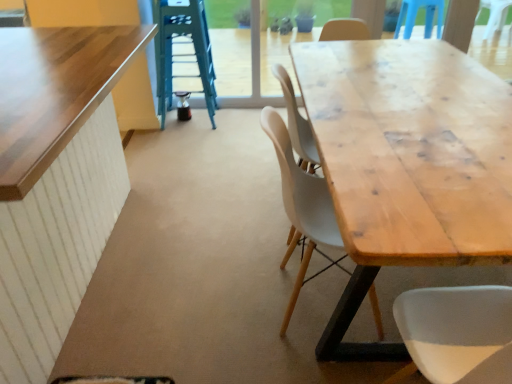
The height and width of the screenshot is (384, 512). What do you see at coordinates (183, 53) in the screenshot?
I see `green metallic ladder at upper center` at bounding box center [183, 53].

In order to face wooden table at left, the 1th table viewed from the left, should I rotate leftwards or rightwards?

To face it directly, rotate left by 30.659 degrees.

The image size is (512, 384). Describe the element at coordinates (301, 207) in the screenshot. I see `matte wood chair at center` at that location.

Find the location of a particular element. This screenshot has width=512, height=384. natural wood table at center, positioned as the first table in right-to-left order is located at coordinates pos(407,163).

What's the angular difference between green metallic ladder at upper center and wooden table at left, marked as the second table in a right-to-left arrangement,'s facing directions?

The facing directions of green metallic ladder at upper center and wooden table at left, marked as the second table in a right-to-left arrangement, are 176 degrees apart.

Is green metallic ladder at upper center facing towards wooden table at left, marked as the second table in a right-to-left arrangement?

Yes, green metallic ladder at upper center is oriented towards wooden table at left, marked as the second table in a right-to-left arrangement.

Consider the image. In terms of size, does green metallic ladder at upper center appear bigger or smaller than wooden table at left, marked as the second table in a right-to-left arrangement?

Clearly, green metallic ladder at upper center is smaller in size than wooden table at left, marked as the second table in a right-to-left arrangement.

In terms of width, does green metallic ladder at upper center look wider or thinner when compared to wooden table at left, marked as the second table in a right-to-left arrangement?

Considering their sizes, green metallic ladder at upper center looks slimmer than wooden table at left, marked as the second table in a right-to-left arrangement.

Is point (347, 248) in front of point (165, 94)?

Yes, it is in front of point (165, 94).

Is natural wood table at center, positioned as the first table in right-to-left order, turned away from green metallic ladder at upper center?

That's not correct — natural wood table at center, positioned as the first table in right-to-left order, is not looking away from green metallic ladder at upper center.

There is a natural wood table at center, positioned as the first table in right-to-left order. Identify the location of ladder above it (from a real-world perspective). Image resolution: width=512 pixels, height=384 pixels. (183, 53).

In the scene shown: From a real-world perspective, is matte wood chair at center positioned under wooden table at left, marked as the second table in a right-to-left arrangement, based on gravity?

Indeed, from a real-world perspective, matte wood chair at center is positioned beneath wooden table at left, marked as the second table in a right-to-left arrangement.

Which object is closer to the camera taking this photo, matte wood chair at center or wooden table at left, marked as the second table in a right-to-left arrangement?

wooden table at left, marked as the second table in a right-to-left arrangement.

Which object is closer to the camera, wooden table at left, marked as the second table in a right-to-left arrangement, or natural wood table at center, positioned as the first table in right-to-left order?

wooden table at left, marked as the second table in a right-to-left arrangement, is closer to the camera.

Can you tell me how much wooden table at left, marked as the second table in a right-to-left arrangement, and natural wood table at center, positioned as the first table in right-to-left order, differ in facing direction?

0.448 degrees.

Considering the sizes of objects wooden table at left, the 1th table viewed from the left, and natural wood table at center, the 2th table when ordered from left to right, in the image provided, who is wider, wooden table at left, the 1th table viewed from the left, or natural wood table at center, the 2th table when ordered from left to right,?

With larger width is wooden table at left, the 1th table viewed from the left.

At what (x,y) coordinates should I click in order to perform the action: click on table behind the wooden table at left, the 1th table viewed from the left. Please return your answer as a coordinate pair (x, y). The image size is (512, 384). Looking at the image, I should click on (407, 163).

Between green metallic ladder at upper center and natural wood table at center, the 2th table when ordered from left to right, which one has larger size?

natural wood table at center, the 2th table when ordered from left to right, is bigger.

Is green metallic ladder at upper center facing away from natural wood table at center, the 2th table when ordered from left to right?

No, green metallic ladder at upper center is not facing the opposite direction of natural wood table at center, the 2th table when ordered from left to right.

Can you confirm if green metallic ladder at upper center is shorter than natural wood table at center, positioned as the first table in right-to-left order?

Incorrect, the height of green metallic ladder at upper center does not fall short of that of natural wood table at center, positioned as the first table in right-to-left order.

Is green metallic ladder at upper center spatially inside natural wood table at center, the 2th table when ordered from left to right, or outside of it?

green metallic ladder at upper center is located beyond the bounds of natural wood table at center, the 2th table when ordered from left to right.

From the image's perspective, is matte wood chair at center on natural wood table at center, the 2th table when ordered from left to right?

Actually, matte wood chair at center appears below natural wood table at center, the 2th table when ordered from left to right, in the image.

At what (x,y) coordinates should I click in order to perform the action: click on chair that is above the natural wood table at center, positioned as the first table in right-to-left order (from a real-world perspective). Please return your answer as a coordinate pair (x, y). This screenshot has height=384, width=512. Looking at the image, I should click on (301, 207).

Considering the sizes of objects matte wood chair at center and natural wood table at center, positioned as the first table in right-to-left order, in the image provided, who is wider, matte wood chair at center or natural wood table at center, positioned as the first table in right-to-left order,?

With larger width is natural wood table at center, positioned as the first table in right-to-left order.

Consider the image. Between natural wood table at center, the 2th table when ordered from left to right, and wooden table at left, marked as the second table in a right-to-left arrangement, which one has larger size?

wooden table at left, marked as the second table in a right-to-left arrangement.

From a real-world perspective, between natural wood table at center, the 2th table when ordered from left to right, and wooden table at left, marked as the second table in a right-to-left arrangement, who is vertically lower?

natural wood table at center, the 2th table when ordered from left to right, from a real-world perspective.

Is natural wood table at center, positioned as the first table in right-to-left order, further to camera compared to wooden table at left, marked as the second table in a right-to-left arrangement?

Yes, natural wood table at center, positioned as the first table in right-to-left order, is further from the camera.

Is natural wood table at center, positioned as the first table in right-to-left order, far from wooden table at left, the 1th table viewed from the left?

Yes.

Find the location of a particular element. Image resolution: width=512 pixels, height=384 pixels. ladder above the wooden table at left, the 1th table viewed from the left (from a real-world perspective) is located at coordinates (183, 53).

This screenshot has width=512, height=384. I want to click on the 1st table in front of the green metallic ladder at upper center, so click(x=407, y=163).

Looking at this image, when comparing their distances from natural wood table at center, positioned as the first table in right-to-left order, does matte wood chair at center or green metallic ladder at upper center seem closer?

matte wood chair at center is positioned closer to the anchor natural wood table at center, positioned as the first table in right-to-left order.

Based on their spatial positions, is natural wood table at center, the 2th table when ordered from left to right, or matte wood chair at center closer to wooden table at left, marked as the second table in a right-to-left arrangement?

Among the two, matte wood chair at center is located nearer to wooden table at left, marked as the second table in a right-to-left arrangement.

From the image, which object appears to be farther from green metallic ladder at upper center, natural wood table at center, positioned as the first table in right-to-left order, or matte wood chair at center?

matte wood chair at center is positioned further to the anchor green metallic ladder at upper center.

Estimate the real-world distances between objects in this image. Which object is further from green metallic ladder at upper center, matte wood chair at center or natural wood table at center, the 2th table when ordered from left to right?

→ Among the two, matte wood chair at center is located further to green metallic ladder at upper center.

Considering their positions, is green metallic ladder at upper center positioned closer to matte wood chair at center than wooden table at left, marked as the second table in a right-to-left arrangement?

The object closer to matte wood chair at center is wooden table at left, marked as the second table in a right-to-left arrangement.

Based on their spatial positions, is natural wood table at center, positioned as the first table in right-to-left order, or wooden table at left, the 1th table viewed from the left, further from matte wood chair at center?

wooden table at left, the 1th table viewed from the left, is positioned further to the anchor matte wood chair at center.

Estimate the real-world distances between objects in this image. Which object is further from natural wood table at center, positioned as the first table in right-to-left order, wooden table at left, marked as the second table in a right-to-left arrangement, or matte wood chair at center?

wooden table at left, marked as the second table in a right-to-left arrangement, is positioned further to the anchor natural wood table at center, positioned as the first table in right-to-left order.

Which object lies further to the anchor point matte wood chair at center, natural wood table at center, the 2th table when ordered from left to right, or green metallic ladder at upper center?

Among the two, green metallic ladder at upper center is located further to matte wood chair at center.

Locate an element on the screen. chair located between natural wood table at center, the 2th table when ordered from left to right, and green metallic ladder at upper center in the depth direction is located at coordinates (301, 207).

Identify the location of table between wooden table at left, the 1th table viewed from the left, and green metallic ladder at upper center in the front-back direction. 407,163.

Identify the location of chair between wooden table at left, the 1th table viewed from the left, and green metallic ladder at upper center from front to back. This screenshot has width=512, height=384. (301, 207).

Identify the location of chair between wooden table at left, marked as the second table in a right-to-left arrangement, and natural wood table at center, positioned as the first table in right-to-left order, in the horizontal direction. (301, 207).